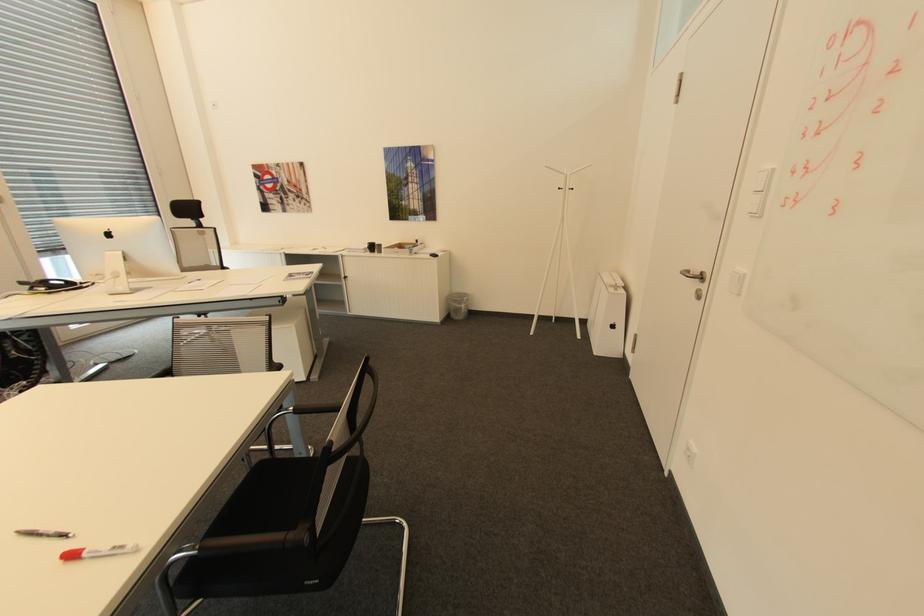
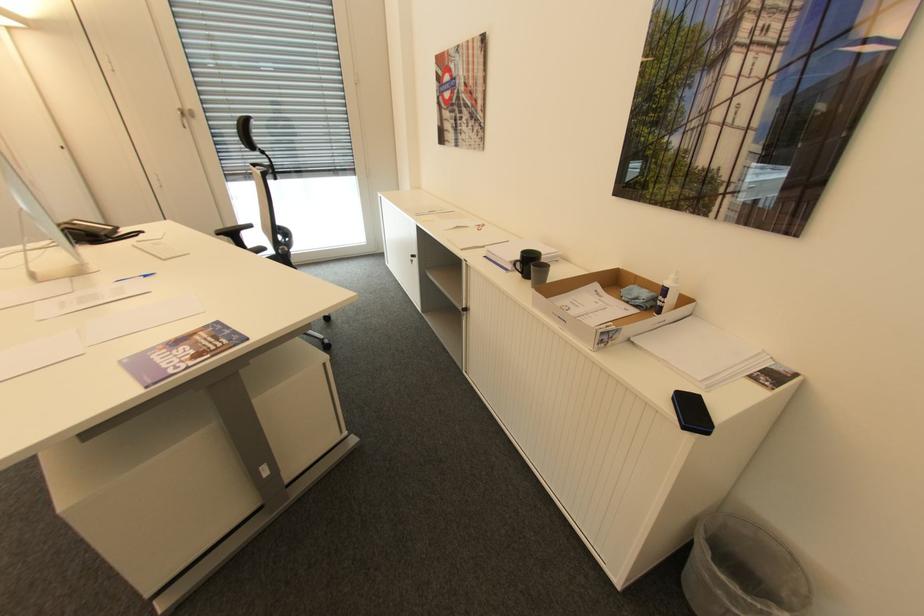
Find the pixel in the second image that matches pixel 457 304 in the first image.

(711, 576)